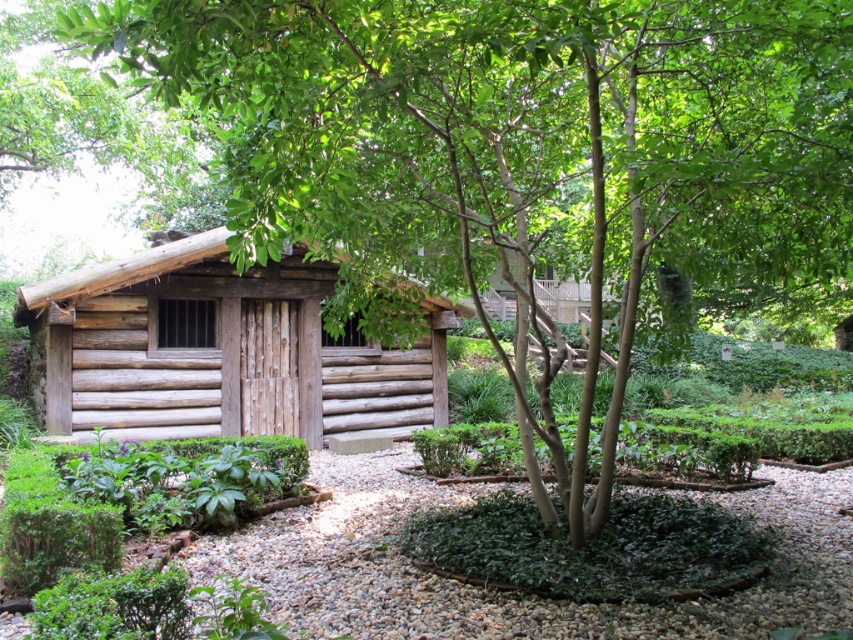
Can you confirm if natural wood log cabin at center is wider than white gravel at center?

Yes, natural wood log cabin at center is wider than white gravel at center.

Is point (281, 333) farther from viewer compared to point (393, 611)?

Yes, point (281, 333) is behind point (393, 611).

Is point (314, 321) closer to viewer compared to point (312, 625)?

No, (314, 321) is further to viewer.

The image size is (853, 640). I want to click on natural wood log cabin at center, so click(219, 349).